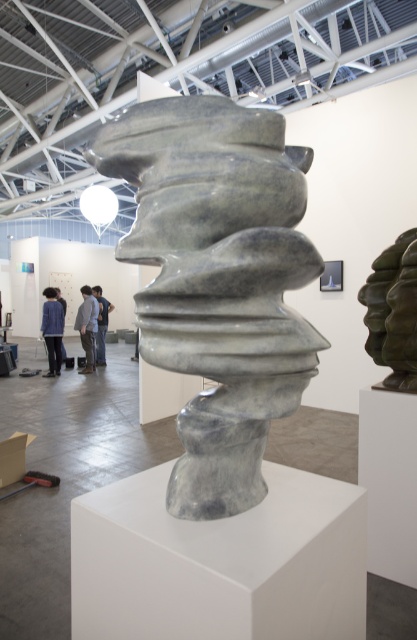
Between gray fabric jacket at center and blue denim jacket at left, which one has more height?

With more height is gray fabric jacket at center.

Is gray fabric jacket at center thinner than blue denim jacket at left?

In fact, gray fabric jacket at center might be wider than blue denim jacket at left.

You are a GUI agent. You are given a task and a screenshot of the screen. Output one action in this format:
    pyautogui.click(x=<x>, y=<y>)
    Task: Click on the gray fabric jacket at center
    Image resolution: width=417 pixels, height=640 pixels.
    Given the screenshot: What is the action you would take?
    pyautogui.click(x=87, y=326)

Which is more to the right, gray stone sculpture at center or blue denim jacket at center?

Positioned to the right is gray stone sculpture at center.

In order to click on gray stone sculpture at center in this screenshot , I will do `click(218, 280)`.

Who is taller, blue jeans at center or blue denim jacket at left?

With more height is blue jeans at center.

Can you confirm if blue jeans at center is taller than blue denim jacket at left?

Correct, blue jeans at center is much taller as blue denim jacket at left.

Locate an element on the screen. Image resolution: width=417 pixels, height=640 pixels. blue jeans at center is located at coordinates (102, 323).